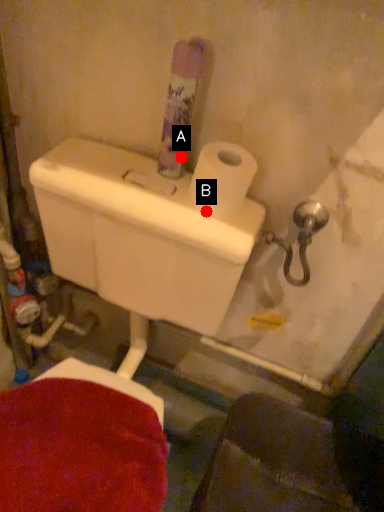
Question: Two points are circled on the image, labeled by A and B beside each circle. Which point is farther to the camera?

Choices:
 (A) A is further
 (B) B is further

Answer: (A)